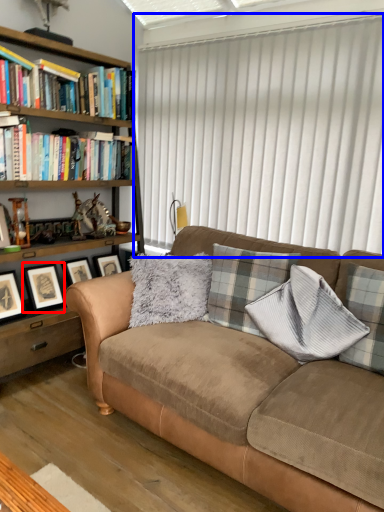
Question: Which of the following is the closest to the observer, picture frame (highlighted by a red box) or window blind (highlighted by a blue box)?

Choices:
 (A) picture frame
 (B) window blind

Answer: (B)